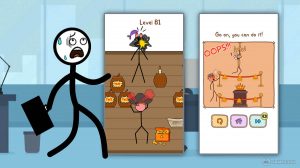
Where is `floor`? The height and width of the screenshot is (168, 300). floor is located at coordinates (196, 160).